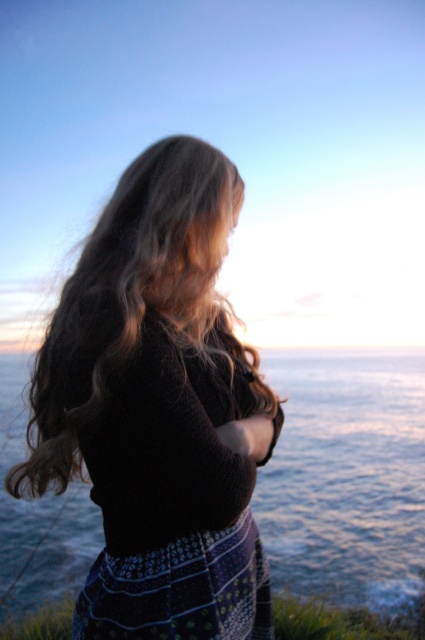
Question: Considering the relative positions of knitted black sweater at center and blue water at center in the image provided, where is knitted black sweater at center located with respect to blue water at center?

Choices:
 (A) right
 (B) left

Answer: (A)

Question: Can you confirm if knitted black sweater at center is positioned below blue water at center?

Choices:
 (A) no
 (B) yes

Answer: (A)

Question: Can you confirm if knitted black sweater at center is positioned to the right of blue water at center?

Choices:
 (A) no
 (B) yes

Answer: (B)

Question: Among these objects, which one is farthest from the camera?

Choices:
 (A) knitted black sweater at center
 (B) blue water at center

Answer: (B)